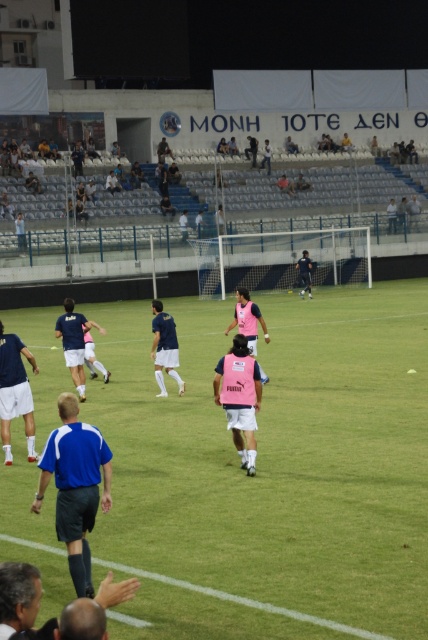
Question: From the image, what is the correct spatial relationship of green grass football field at center in relation to blue fabric shirt at center?

Choices:
 (A) right
 (B) left

Answer: (B)

Question: Which of these objects is positioned farthest from the pink matte vest at center?

Choices:
 (A) pink fabric vest at center
 (B) pink fabric shirt at center

Answer: (B)

Question: Is pink matte vest at center thinner than dark blue jersey at center?

Choices:
 (A) no
 (B) yes

Answer: (A)

Question: Which object appears farthest from the camera in this image?

Choices:
 (A) blue fabric shorts at left
 (B) blue fabric shirt at center
 (C) blue jersey at center
 (D) pink fabric vest at center

Answer: (C)

Question: Which point is farther from the camera taking this photo?

Choices:
 (A) (154, 307)
 (B) (14, 404)
 (C) (133, 582)

Answer: (A)

Question: Does blue fabric shirt at center lie in front of blue fabric shorts at left?

Choices:
 (A) yes
 (B) no

Answer: (A)